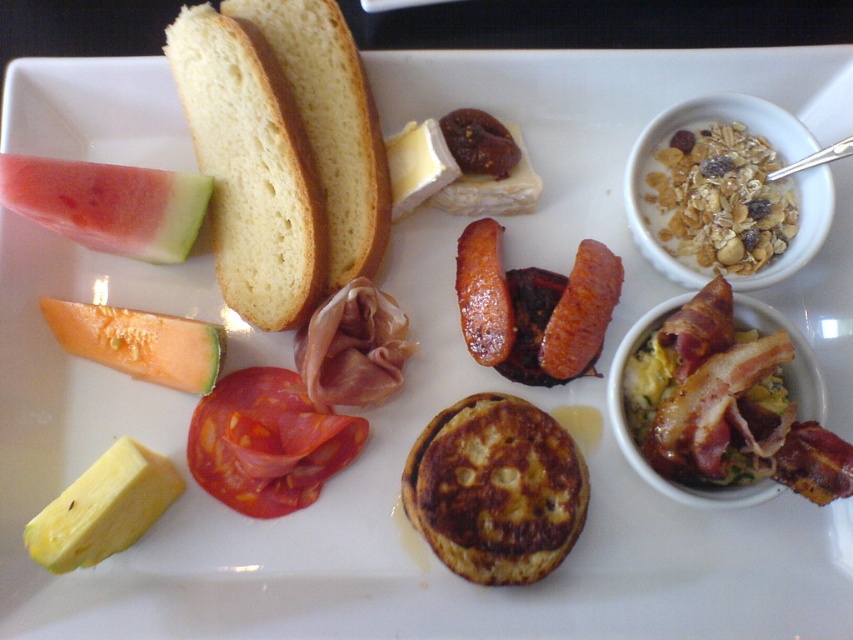
What do you see at coordinates (267, 442) in the screenshot?
I see `sliced red tomato at center-left` at bounding box center [267, 442].

Is sliced red tomato at center-left positioned in front of brown crispy sausage at center-right?

Yes.

Describe the element at coordinates (267, 442) in the screenshot. This screenshot has height=640, width=853. I see `sliced red tomato at center-left` at that location.

The image size is (853, 640). Find the location of `sliced red tomato at center-left`. sliced red tomato at center-left is located at coordinates (267, 442).

Looking at this image, does yellow butter at lower left appear over brown crispy sausage at center-right?

No, yellow butter at lower left is not above brown crispy sausage at center-right.

Does yellow butter at lower left have a larger size compared to brown crispy sausage at center-right?

Indeed, yellow butter at lower left has a larger size compared to brown crispy sausage at center-right.

Does point (149, 518) come in front of point (548, 321)?

Yes.

The height and width of the screenshot is (640, 853). What are the coordinates of `yellow butter at lower left` in the screenshot? It's located at (103, 508).

Who is more distant from viewer, (309, 97) or (436, 154)?

The point (436, 154) is behind.

Find the location of `golden brown crusty bread at upper left`. golden brown crusty bread at upper left is located at coordinates (329, 124).

Does point (294, 8) come farther from viewer compared to point (410, 140)?

No, (294, 8) is in front of (410, 140).

Find the location of a particular element. This screenshot has width=853, height=640. golden brown crusty bread at upper left is located at coordinates (329, 124).